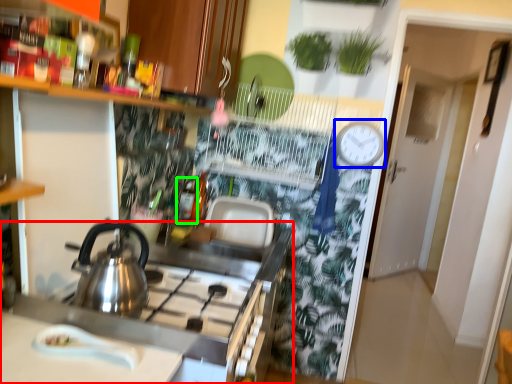
Question: Which is nearer to the counter (highlighted by a red box)? clock (highlighted by a blue box) or bottle (highlighted by a green box).

Choices:
 (A) clock
 (B) bottle

Answer: (B)